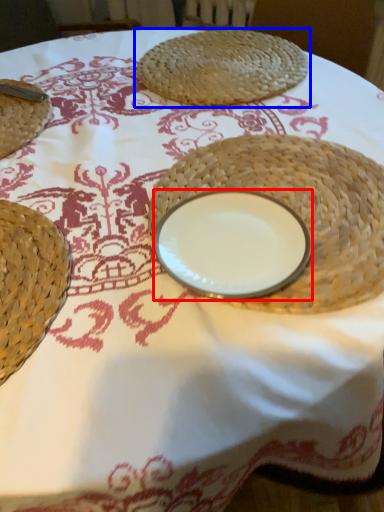
Question: Which object appears farthest to the camera in this image, tableware (highlighted by a red box) or food (highlighted by a blue box)?

Choices:
 (A) tableware
 (B) food

Answer: (B)